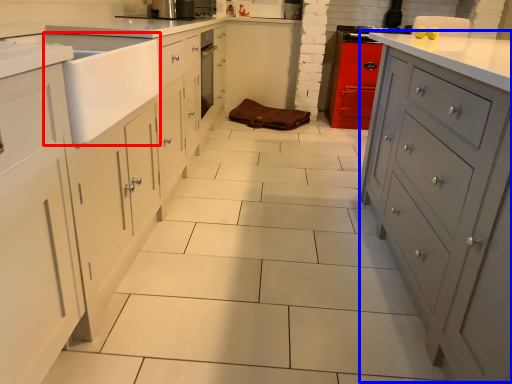
Question: Which of the following is the closest to the observer, sink (highlighted by a red box) or file cabinet (highlighted by a blue box)?

Choices:
 (A) sink
 (B) file cabinet

Answer: (B)